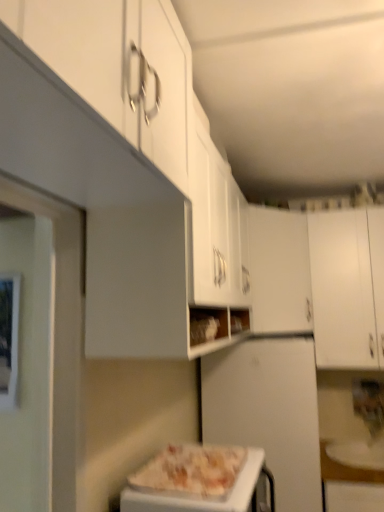
Question: Does white glossy plate at lower right have a larger size compared to white matte cabinet at right, the second cabinetry from the left?

Choices:
 (A) yes
 (B) no

Answer: (B)

Question: From a real-world perspective, is white glossy plate at lower right physically below white matte cabinet at right, the second cabinetry from the left?

Choices:
 (A) yes
 (B) no

Answer: (A)

Question: Does white glossy plate at lower right contain white matte cabinet at right, the first cabinetry viewed from the right?

Choices:
 (A) yes
 (B) no

Answer: (B)

Question: Is white glossy plate at lower right not near white matte cabinet at right, the second cabinetry from the left?

Choices:
 (A) yes
 (B) no

Answer: (B)

Question: Can you confirm if white glossy plate at lower right is wider than white matte cabinet at right, the first cabinetry viewed from the right?

Choices:
 (A) yes
 (B) no

Answer: (A)

Question: In the image, is white glossy pizza at center on the left side or the right side of white matte refrigerator at center?

Choices:
 (A) left
 (B) right

Answer: (A)

Question: Is white glossy pizza at center bigger or smaller than white matte refrigerator at center?

Choices:
 (A) small
 (B) big

Answer: (A)

Question: Is white glossy pizza at center wider or thinner than white matte refrigerator at center?

Choices:
 (A) wide
 (B) thin

Answer: (B)

Question: From a real-world perspective, is white glossy pizza at center physically located above or below white matte refrigerator at center?

Choices:
 (A) below
 (B) above

Answer: (B)

Question: Does point (302, 302) appear closer or farther from the camera than point (220, 492)?

Choices:
 (A) closer
 (B) farther

Answer: (B)

Question: Based on their sizes in the image, would you say white matte cabinet at center, arranged as the first cabinetry when viewed from the left, is bigger or smaller than white glossy pizza at center?

Choices:
 (A) big
 (B) small

Answer: (A)

Question: From the image's perspective, is white matte cabinet at center, acting as the second cabinetry starting from the right, above or below white glossy pizza at center?

Choices:
 (A) above
 (B) below

Answer: (A)

Question: Is white matte cabinet at center, arranged as the first cabinetry when viewed from the left, wider or thinner than white glossy pizza at center?

Choices:
 (A) thin
 (B) wide

Answer: (B)

Question: From a real-world perspective, is white matte cabinet at center, arranged as the first cabinetry when viewed from the left, physically located above or below white matte cabinet at right, the first cabinetry viewed from the right?

Choices:
 (A) above
 (B) below

Answer: (A)

Question: Is point (286, 218) closer or farther from the camera than point (370, 330)?

Choices:
 (A) closer
 (B) farther

Answer: (B)